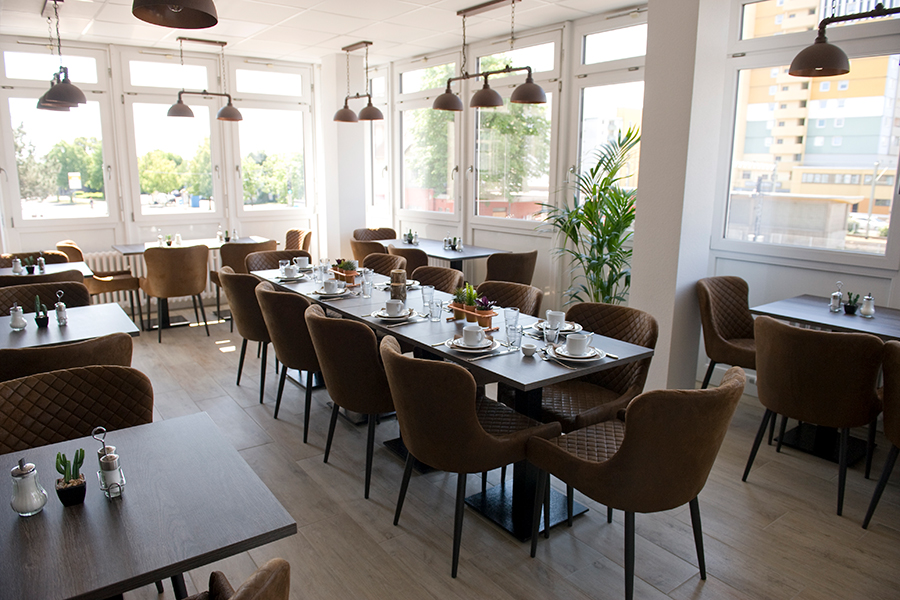
You are a GUI agent. You are given a task and a screenshot of the screen. Output one action in this format:
    pyautogui.click(x=<x>, y=<y>)
    Task: Click on the white coffee cups
    The image size is (900, 600).
    Given the screenshot: What is the action you would take?
    pyautogui.click(x=576, y=341), pyautogui.click(x=555, y=316), pyautogui.click(x=472, y=334), pyautogui.click(x=393, y=304), pyautogui.click(x=334, y=284), pyautogui.click(x=291, y=269), pyautogui.click(x=300, y=259), pyautogui.click(x=356, y=261)